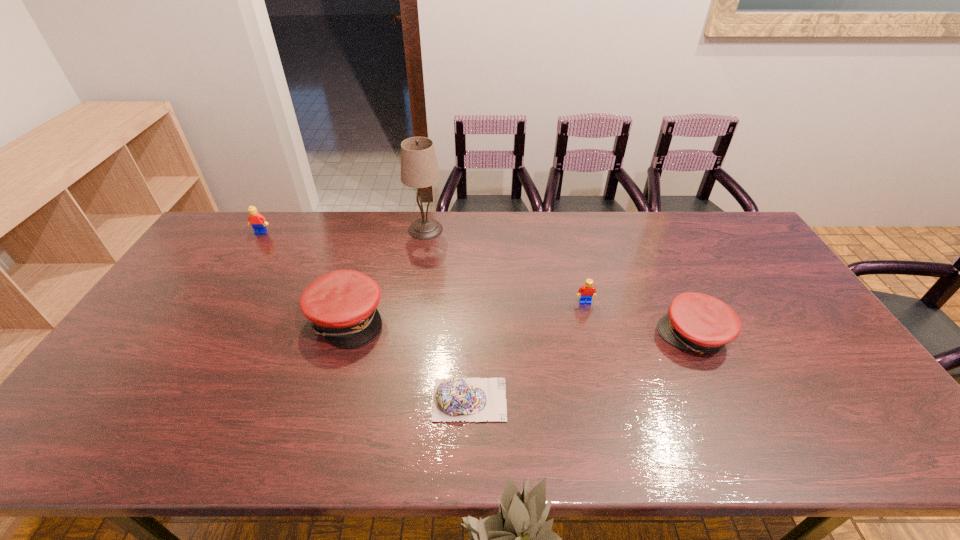
The width and height of the screenshot is (960, 540). Identify the location of lampshade. (419, 169).

Locate an element on the screen. the tallest object is located at coordinates (419, 169).

Locate an element on the screen. The image size is (960, 540). the leftmost object is located at coordinates (258, 222).

Locate an element on the screen. This screenshot has width=960, height=540. the farther Lego is located at coordinates (258, 222).

Find the location of a particular element. the second object from left to right is located at coordinates (341, 305).

The width and height of the screenshot is (960, 540). I want to click on the leftmost cap, so click(x=341, y=305).

Find the location of a particular element. This screenshot has height=540, width=960. the fifth object from left to right is located at coordinates (587, 291).

Identify the location of the nearer Lego. The height and width of the screenshot is (540, 960). tap(587, 291).

The image size is (960, 540). Find the location of `the rightmost cap`. the rightmost cap is located at coordinates (695, 321).

You are a GUI agent. You are given a task and a screenshot of the screen. Output one action in this format:
    pyautogui.click(x=<x>, y=<y>)
    Task: Click on the second shortest cap
    The image size is (960, 540).
    Given the screenshot: What is the action you would take?
    pyautogui.click(x=695, y=321)